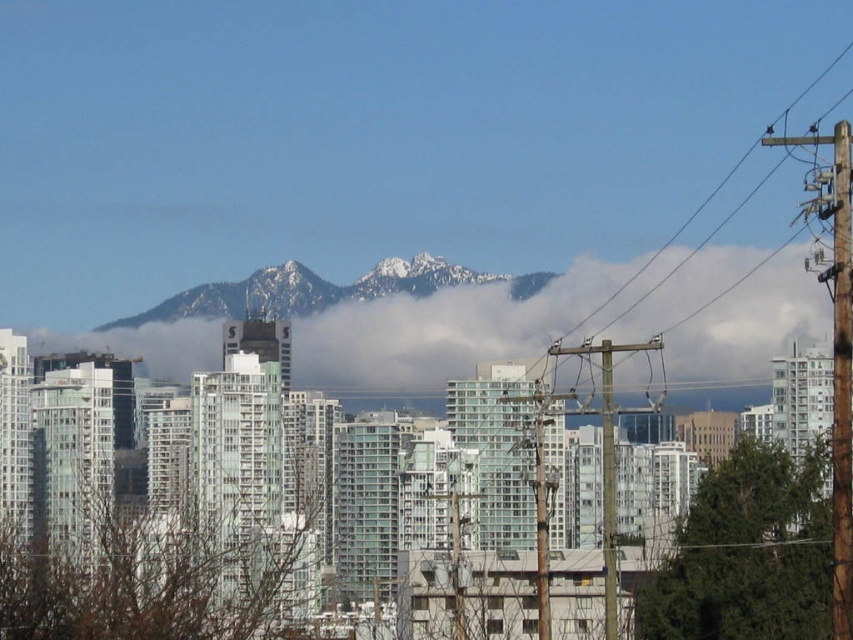
Who is positioned more to the left, white fluffy cloud at center or snowy rocky mountain at center?

From the viewer's perspective, snowy rocky mountain at center appears more on the left side.

Is white fluffy cloud at center wider than snowy rocky mountain at center?

Yes.

Is point (764, 349) closer to viewer compared to point (206, 310)?

No, (764, 349) is behind (206, 310).

Image resolution: width=853 pixels, height=640 pixels. I want to click on white fluffy cloud at center, so click(x=438, y=332).